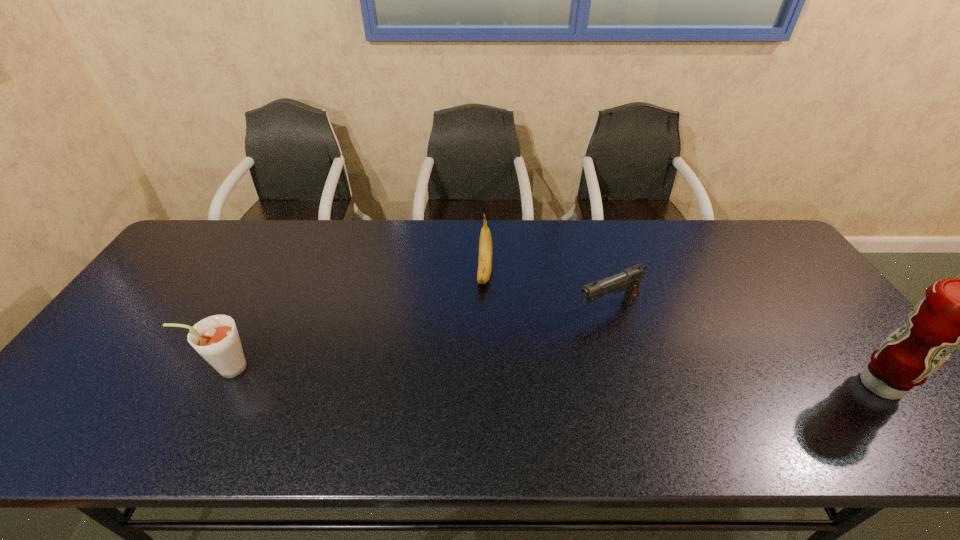
You are a GUI agent. You are given a task and a screenshot of the screen. Output one action in this format:
    pyautogui.click(x=<x>, y=<y>)
    Task: Click on the free spot on the desktop that is between the leftmost object and the rightmost object and is positioned in the direction the third nearest object is aimed
    The image size is (960, 540).
    Given the screenshot: What is the action you would take?
    pyautogui.click(x=459, y=374)

Image resolution: width=960 pixels, height=540 pixels. I want to click on vacant space on the desktop that is between the root beer and the tallest object and is positioned at the start of the peel on the banana, so click(475, 374).